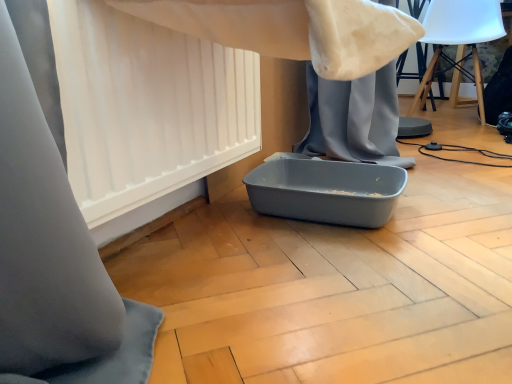
The height and width of the screenshot is (384, 512). I want to click on white matte curtain at lower left, so click(x=146, y=106).

The image size is (512, 384). What do you see at coordinates (146, 106) in the screenshot? I see `white matte curtain at lower left` at bounding box center [146, 106].

Consider the image. Measure the distance between white matte curtain at lower left and camera.

white matte curtain at lower left is 24.25 inches from camera.

The height and width of the screenshot is (384, 512). What do you see at coordinates (459, 38) in the screenshot?
I see `white plastic swivel chair at upper right` at bounding box center [459, 38].

This screenshot has height=384, width=512. In order to click on white plastic swivel chair at upper right in this screenshot , I will do `click(459, 38)`.

Find the location of a particular element. The height and width of the screenshot is (384, 512). white matte curtain at lower left is located at coordinates (146, 106).

Visually, is white plastic swivel chair at upper right positioned to the left or to the right of white matte curtain at lower left?

Based on their positions, white plastic swivel chair at upper right is located to the right of white matte curtain at lower left.

Is white plastic swivel chair at upper right further to the viewer compared to white matte curtain at lower left?

Yes, it is.

Which is in front, point (465, 16) or point (230, 101)?

The point (230, 101) is in front.

Looking at this image, from the image's perspective, which object appears higher, white plastic swivel chair at upper right or white matte curtain at lower left?

white plastic swivel chair at upper right.

From a real-world perspective, is white plastic swivel chair at upper right under white matte curtain at lower left?

No.

Is white plastic swivel chair at upper right wider or thinner than white matte curtain at lower left?

Considering their sizes, white plastic swivel chair at upper right looks broader than white matte curtain at lower left.

Who is taller, white plastic swivel chair at upper right or white matte curtain at lower left?

white plastic swivel chair at upper right.

Between white plastic swivel chair at upper right and white matte curtain at lower left, which one has smaller size?

Smaller between the two is white matte curtain at lower left.

Is white matte curtain at lower left inside white plastic swivel chair at upper right?

No.

Is white plastic swivel chair at upper right positioned far away from white matte curtain at lower left?

white plastic swivel chair at upper right is far away from white matte curtain at lower left.

Is white plastic swivel chair at upper right oriented away from white matte curtain at lower left?

That's not correct — white plastic swivel chair at upper right is not looking away from white matte curtain at lower left.

Can you tell me how much white plastic swivel chair at upper right and white matte curtain at lower left differ in facing direction?

The angular difference between white plastic swivel chair at upper right and white matte curtain at lower left is 86.9 degrees.

Identify the location of curtain below the white plastic swivel chair at upper right (from the image's perspective). The height and width of the screenshot is (384, 512). (146, 106).

Which is more to the left, white matte curtain at lower left or white plastic swivel chair at upper right?

white matte curtain at lower left is more to the left.

Is the depth of white matte curtain at lower left greater than that of white plastic swivel chair at upper right?

No, it is in front of white plastic swivel chair at upper right.

Is point (116, 175) less distant than point (469, 12)?

Yes.

From the image's perspective, is white matte curtain at lower left below white plastic swivel chair at upper right?

Correct, white matte curtain at lower left appears lower than white plastic swivel chair at upper right in the image.

From a real-world perspective, who is located higher, white matte curtain at lower left or white plastic swivel chair at upper right?

white plastic swivel chair at upper right.

Is white matte curtain at lower left wider than white plastic swivel chair at upper right?

In fact, white matte curtain at lower left might be narrower than white plastic swivel chair at upper right.

Who is shorter, white matte curtain at lower left or white plastic swivel chair at upper right?

white matte curtain at lower left is shorter.

Considering the relative sizes of white matte curtain at lower left and white plastic swivel chair at upper right in the image provided, is white matte curtain at lower left bigger than white plastic swivel chair at upper right?

No.

Is white matte curtain at lower left surrounding white plastic swivel chair at upper right?

No.

Are white matte curtain at lower left and white plastic swivel chair at upper right located far from each other?

Yes, white matte curtain at lower left is far from white plastic swivel chair at upper right.

Is white matte curtain at lower left positioned with its back to white plastic swivel chair at upper right?

No, white matte curtain at lower left is not facing away from white plastic swivel chair at upper right.

Can you tell me how much white matte curtain at lower left and white plastic swivel chair at upper right differ in facing direction?

The facing directions of white matte curtain at lower left and white plastic swivel chair at upper right are 86.9 degrees apart.

Measure the distance from white matte curtain at lower left to white plastic swivel chair at upper right.

A distance of 6.14 feet exists between white matte curtain at lower left and white plastic swivel chair at upper right.

Identify the location of curtain on the left side of white plastic swivel chair at upper right. This screenshot has width=512, height=384. (146, 106).

Where is `curtain that is in front of the white plastic swivel chair at upper right`? This screenshot has height=384, width=512. curtain that is in front of the white plastic swivel chair at upper right is located at coordinates (146, 106).

This screenshot has height=384, width=512. I want to click on curtain below the white plastic swivel chair at upper right (from the image's perspective), so click(x=146, y=106).